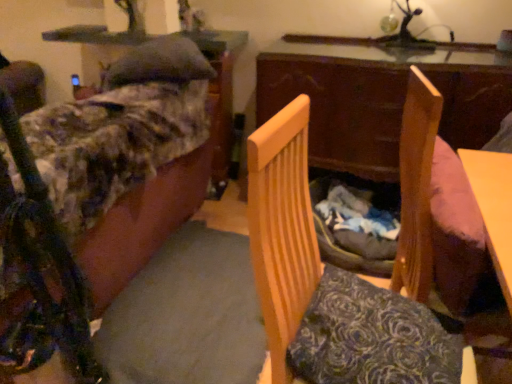
Question: Considering the relative sizes of wooden chair at center, the 1th furniture positioned from the right, and wooden swivel chair at right in the image provided, is wooden chair at center, the 1th furniture positioned from the right, smaller than wooden swivel chair at right?

Choices:
 (A) no
 (B) yes

Answer: (A)

Question: Is wooden chair at center, the 1th furniture positioned from the right, shorter than wooden swivel chair at right?

Choices:
 (A) no
 (B) yes

Answer: (A)

Question: Is wooden chair at center, the 2th furniture viewed from the left, at the left side of wooden swivel chair at right?

Choices:
 (A) yes
 (B) no

Answer: (A)

Question: Is wooden chair at center, the 2th furniture viewed from the left, at the right side of wooden swivel chair at right?

Choices:
 (A) yes
 (B) no

Answer: (B)

Question: Is wooden chair at center, the 1th furniture positioned from the right, further to camera compared to wooden swivel chair at right?

Choices:
 (A) yes
 (B) no

Answer: (B)

Question: In terms of width, does wooden chair at center, the 2th furniture viewed from the left, look wider or thinner when compared to fluffy fabric couch at left, positioned as the second furniture in right-to-left order?

Choices:
 (A) wide
 (B) thin

Answer: (B)

Question: Would you say wooden chair at center, the 1th furniture positioned from the right, is to the left or to the right of fluffy fabric couch at left, marked as the 1th furniture in a left-to-right arrangement, in the picture?

Choices:
 (A) right
 (B) left

Answer: (A)

Question: In terms of height, does wooden chair at center, the 2th furniture viewed from the left, look taller or shorter compared to fluffy fabric couch at left, positioned as the second furniture in right-to-left order?

Choices:
 (A) short
 (B) tall

Answer: (B)

Question: In terms of size, does wooden chair at center, the 1th furniture positioned from the right, appear bigger or smaller than fluffy fabric couch at left, marked as the 1th furniture in a left-to-right arrangement?

Choices:
 (A) big
 (B) small

Answer: (B)

Question: Is fluffy fabric couch at left, marked as the 1th furniture in a left-to-right arrangement, bigger or smaller than wooden table at center?

Choices:
 (A) small
 (B) big

Answer: (B)

Question: From their relative heights in the image, would you say fluffy fabric couch at left, positioned as the second furniture in right-to-left order, is taller or shorter than wooden table at center?

Choices:
 (A) short
 (B) tall

Answer: (B)

Question: In terms of width, does fluffy fabric couch at left, marked as the 1th furniture in a left-to-right arrangement, look wider or thinner when compared to wooden table at center?

Choices:
 (A) wide
 (B) thin

Answer: (A)

Question: Would you say fluffy fabric couch at left, positioned as the second furniture in right-to-left order, is inside or outside wooden table at center?

Choices:
 (A) outside
 (B) inside

Answer: (A)

Question: From the image's perspective, relative to wooden chair at center, the 1th furniture positioned from the right, is wooden swivel chair at right above or below?

Choices:
 (A) below
 (B) above

Answer: (B)

Question: Would you say wooden swivel chair at right is to the left or to the right of wooden chair at center, the 1th furniture positioned from the right, in the picture?

Choices:
 (A) right
 (B) left

Answer: (A)